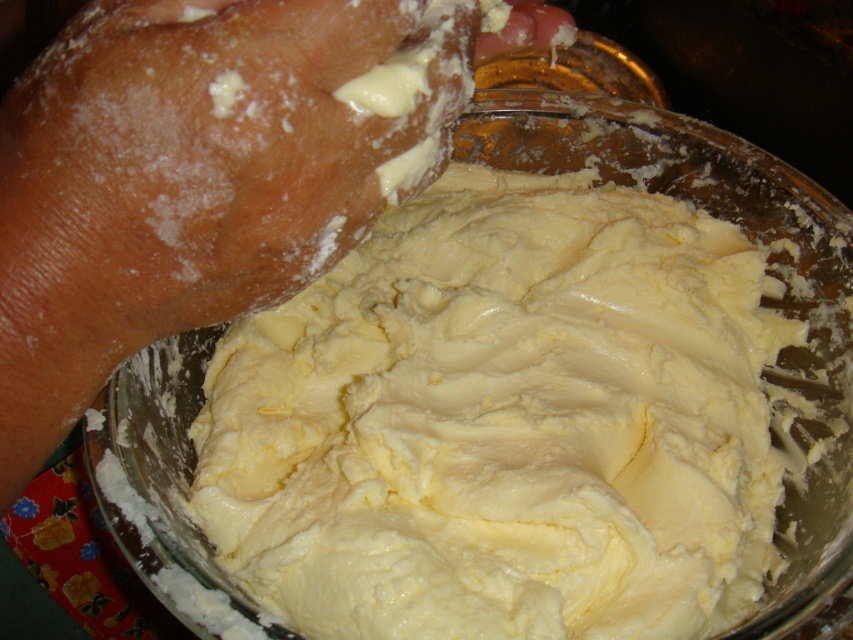
In order to click on yellow creamy dough at center in this screenshot , I will do `click(503, 422)`.

Is yellow creamy dough at center above flesh-toned skin at upper center?

Actually, yellow creamy dough at center is below flesh-toned skin at upper center.

Is point (450, 193) positioned in front of point (512, 4)?

No, (450, 193) is behind (512, 4).

Identify the location of yellow creamy dough at center. (503, 422).